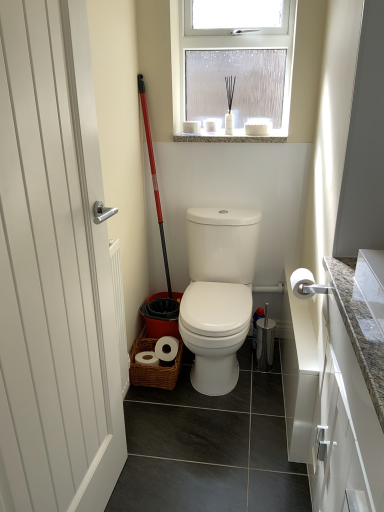
What do you see at coordinates (54, 271) in the screenshot? The width and height of the screenshot is (384, 512). I see `white glossy door at left` at bounding box center [54, 271].

Identify the location of red plastic shovel at center. This screenshot has height=512, width=384. (154, 178).

At what (x,y) coordinates should I click in order to perform the action: click on white glossy toilet at center. Please return your answer as a coordinate pair (x, y). The width and height of the screenshot is (384, 512). Looking at the image, I should click on (218, 293).

Looking at this image, is clear frosted glass at upper center not near white glossy toilet at center?

That's not correct — clear frosted glass at upper center is a little close to white glossy toilet at center.

Does clear frosted glass at upper center have a lesser width compared to white glossy toilet at center?

Correct, the width of clear frosted glass at upper center is less than that of white glossy toilet at center.

Who is more distant, clear frosted glass at upper center or white glossy toilet at center?

clear frosted glass at upper center is more distant.

Looking at this image, in the image, is clear frosted glass at upper center on the left side or the right side of white glossy toilet at center?

Based on their positions, clear frosted glass at upper center is located to the right of white glossy toilet at center.

Considering the points (270, 47) and (238, 141), which point is in front, point (270, 47) or point (238, 141)?

The point (238, 141) is closer.

Where is `window sill behind the clear frosted glass at upper center`? The width and height of the screenshot is (384, 512). window sill behind the clear frosted glass at upper center is located at coordinates (233, 137).

From a real-world perspective, is clear frosted glass at upper center physically above granite at upper center?

Correct, in the physical world, clear frosted glass at upper center is higher than granite at upper center.

Which of these two, clear frosted glass at upper center or granite at upper center, stands shorter?

Standing shorter between the two is granite at upper center.

Based on the photo, who is shorter, white glossy door at left or clear frosted glass at upper center?

clear frosted glass at upper center.

How different are the orientations of white glossy door at left and clear frosted glass at upper center in degrees?

white glossy door at left and clear frosted glass at upper center are facing 88.5 degrees away from each other.

From a real-world perspective, is white glossy door at left physically above clear frosted glass at upper center?

No.

Is clear frosted glass at upper center located within white glossy door at left?

No, clear frosted glass at upper center is not inside white glossy door at left.

Is white glossy toilet at center not close to white matte toilet paper at right?

They are positioned close to each other.

From the image's perspective, would you say white glossy toilet at center is positioned over white matte toilet paper at right?

No, from the image's perspective, white glossy toilet at center is not on top of white matte toilet paper at right.

Does white glossy toilet at center appear on the right side of white matte toilet paper at right?

No, white glossy toilet at center is not to the right of white matte toilet paper at right.

Looking at the image, does white glossy toilet at center seem bigger or smaller compared to white matte toilet paper at right?

white glossy toilet at center is bigger than white matte toilet paper at right.

Is white glossy door at left next to red plastic shovel at center and touching it?

No, white glossy door at left is not next to red plastic shovel at center.

Is white glossy door at left thinner than red plastic shovel at center?

Indeed, white glossy door at left has a lesser width compared to red plastic shovel at center.

From a real-world perspective, is white glossy door at left on top of red plastic shovel at center?

No, from a real-world perspective, white glossy door at left is not on top of red plastic shovel at center.

Visually, is white glossy door at left positioned to the left or to the right of red plastic shovel at center?

Based on their positions, white glossy door at left is located to the left of red plastic shovel at center.

Can we say white glossy door at left lies outside granite at upper center?

That's correct, white glossy door at left is outside of granite at upper center.

From the picture: How different are the orientations of white glossy door at left and granite at upper center in degrees?

The angular difference between white glossy door at left and granite at upper center is 88.6 degrees.

Does white glossy door at left turn towards granite at upper center?

No, white glossy door at left does not turn towards granite at upper center.

From a real-world perspective, is white glossy toilet at center physically located above or below granite at upper center?

From a real-world perspective, white glossy toilet at center is physically below granite at upper center.

Between white glossy toilet at center and granite at upper center, which one has larger size?

white glossy toilet at center is bigger.

Image resolution: width=384 pixels, height=512 pixels. I want to click on toilet in front of the granite at upper center, so click(x=218, y=293).

Is white glossy toilet at center next to granite at upper center?

white glossy toilet at center and granite at upper center are not in contact.

Identify the location of toilet that is under the clear frosted glass at upper center (from a real-world perspective). This screenshot has height=512, width=384. (218, 293).

You are a GUI agent. You are given a task and a screenshot of the screen. Output one action in this format:
    pyautogui.click(x=<x>, y=<y>)
    Task: Click on the window that is above the granite at upper center (from a real-world perspective)
    Image resolution: width=384 pixels, height=512 pixels.
    Given the screenshot: What is the action you would take?
    pyautogui.click(x=234, y=66)

Based on their spatial positions, is white glossy door at left or granite at upper center closer to clear frosted glass at upper center?

Among the two, granite at upper center is located nearer to clear frosted glass at upper center.

From the image, which object appears to be nearer to white glossy door at left, clear frosted glass at upper center or red plastic shovel at center?

red plastic shovel at center is closer to white glossy door at left.

Based on their spatial positions, is white matte toilet paper at right or white glossy door at left closer to white glossy toilet at center?

The object closer to white glossy toilet at center is white matte toilet paper at right.

From the image, which object appears to be farther from white glossy toilet at center, clear frosted glass at upper center or red plastic shovel at center?

Based on the image, clear frosted glass at upper center appears to be further to white glossy toilet at center.

Looking at the image, which one is located closer to white matte toilet paper at right, red plastic shovel at center or clear frosted glass at upper center?

red plastic shovel at center.

When comparing their distances from white glossy door at left, does red plastic shovel at center or white glossy toilet at center seem closer?

white glossy toilet at center is closer to white glossy door at left.

Considering their positions, is white matte toilet paper at right positioned closer to red plastic shovel at center than clear frosted glass at upper center?

clear frosted glass at upper center.

Looking at the image, which one is located closer to clear frosted glass at upper center, red plastic shovel at center or white matte toilet paper at right?

The object closer to clear frosted glass at upper center is red plastic shovel at center.

Identify the location of toilet paper between white glossy door at left and red plastic shovel at center along the z-axis. This screenshot has height=512, width=384. (302, 283).

Identify the location of toilet paper between white glossy door at left and granite at upper center in the front-back direction. (302, 283).

Identify the location of toilet paper between clear frosted glass at upper center and white glossy toilet at center in the up-down direction. The width and height of the screenshot is (384, 512). (302, 283).

Image resolution: width=384 pixels, height=512 pixels. I want to click on toilet paper between white glossy door at left and white glossy toilet at center along the z-axis, so click(302, 283).